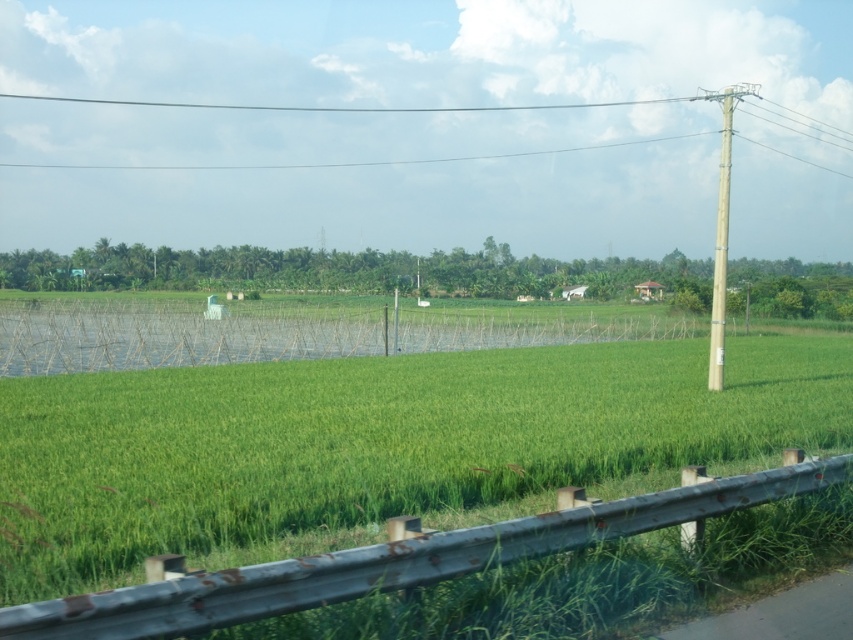
You are a hiker standing on the road with the metal guardrail in front of you. You see the green grass at center and the smooth wire power line at upper center. Which object appears closer to you?

The green grass at center appears closer to you because it has a smaller size compared to the smooth wire power line at upper center, which typically indicates it is nearer in perspective.

You are standing at the guardrail in the foreground. You see the green grass at center and the fence in the midground. Which one is closer to you?

The green grass at center is closer to you than the fence in the midground because they are 16.36 feet apart.

You are a bird flying over a rural area and see the green grass at center and the smooth wire power line at upper center. Which object is located to the right of the other?

The green grass at center is positioned on the right side of smooth wire power line at upper center.